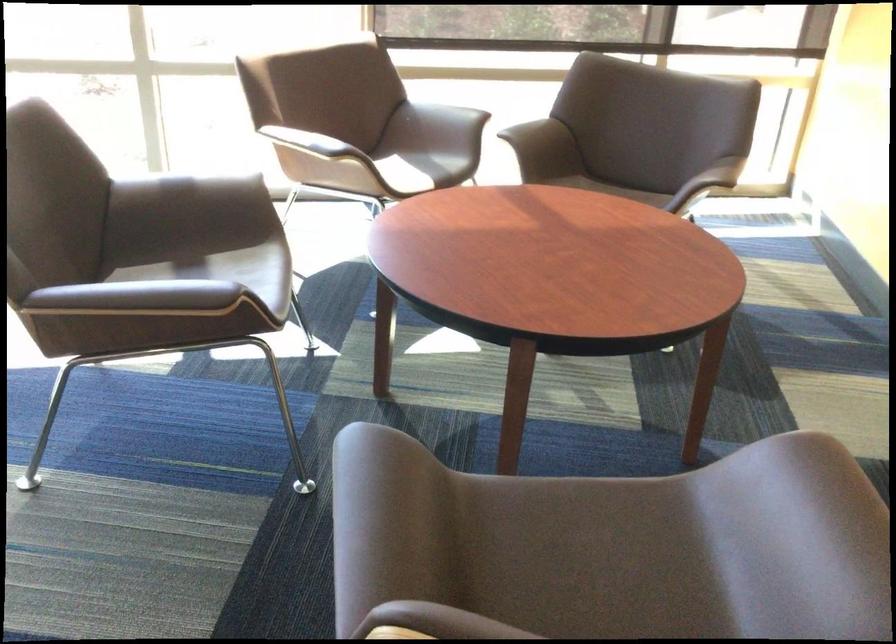
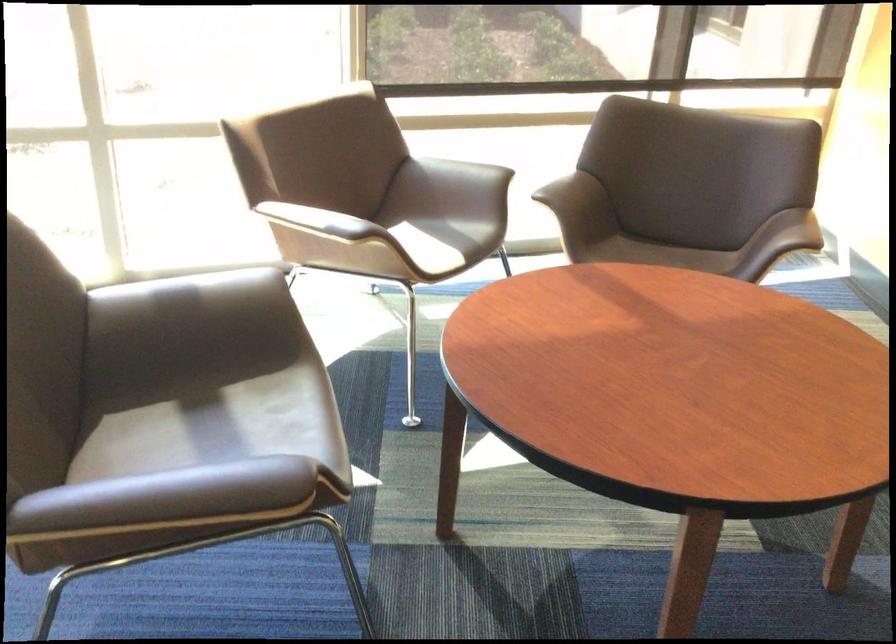
What movement of the cameraman would produce the second image?

The cameraman walked toward left, forward.